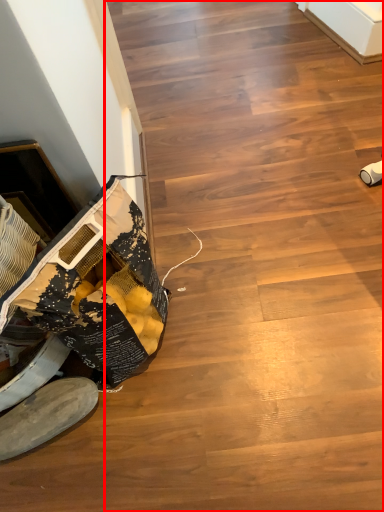
Question: From the image's perspective, what is the correct spatial relationship of stairwell (annotated by the red box) in relation to footwear?

Choices:
 (A) above
 (B) below

Answer: (A)